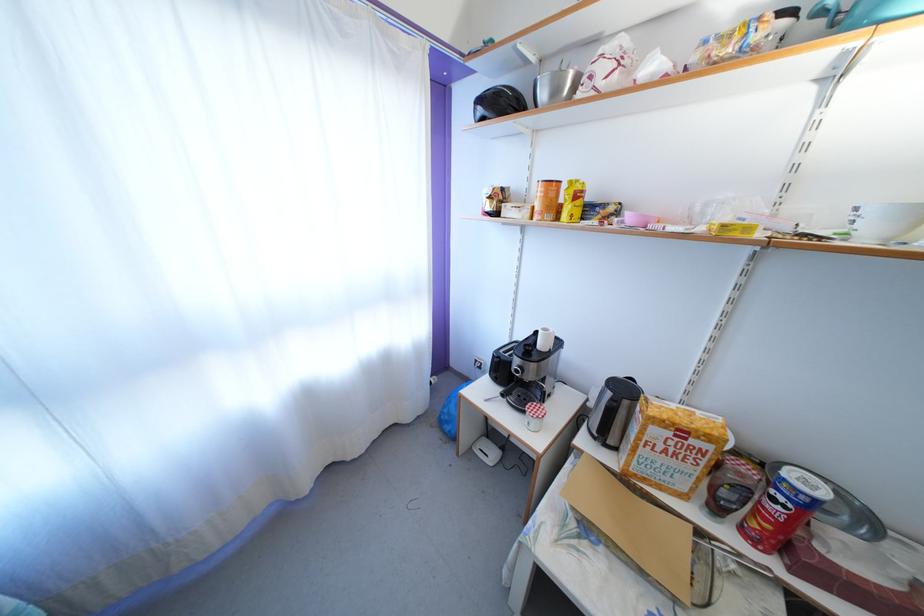
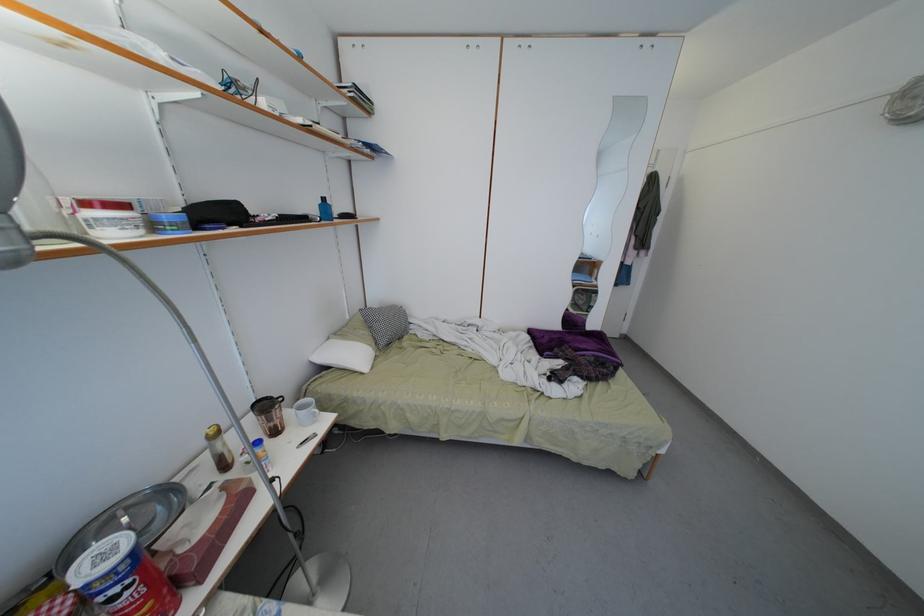
Find the pixel in the second image that matches the point at 852,524 in the first image.

(165, 514)